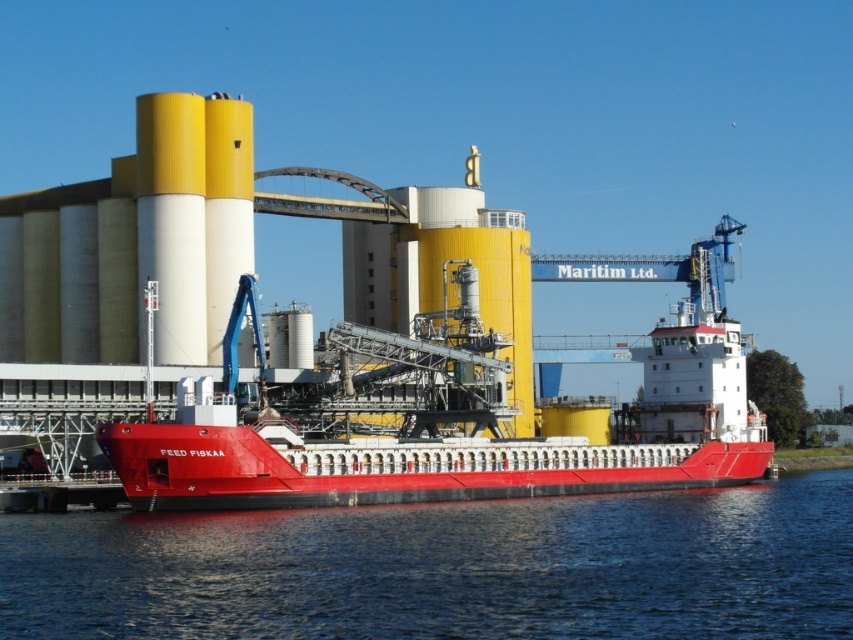
Can you confirm if transparent blue water at lower center is taller than metallic red barge at center?

No, transparent blue water at lower center is not taller than metallic red barge at center.

Does transparent blue water at lower center appear over metallic red barge at center?

Actually, transparent blue water at lower center is below metallic red barge at center.

Measure the distance between transparent blue water at lower center and camera.

transparent blue water at lower center and camera are 49.09 meters apart from each other.

Find the location of `transparent blue water at lower center`. transparent blue water at lower center is located at coordinates (445, 566).